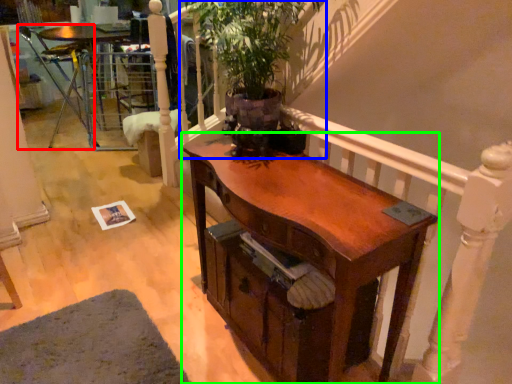
Question: Considering the real-world distances, which object is farthest from armchair (highlighted by a red box)? houseplant (highlighted by a blue box) or desk (highlighted by a green box)?

Choices:
 (A) houseplant
 (B) desk

Answer: (B)